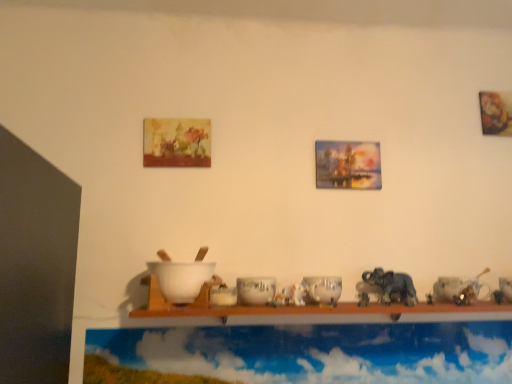
Question: From a real-world perspective, does white glossy bowl at center, which is the 2th tableware in left-to-right order, stand above cloudy sky at upper center?

Choices:
 (A) no
 (B) yes

Answer: (B)

Question: From the image's perspective, does white glossy bowl at center, arranged as the third tableware when viewed from the right, appear lower than cloudy sky at upper center?

Choices:
 (A) yes
 (B) no

Answer: (B)

Question: Is white glossy bowl at center, arranged as the third tableware when viewed from the right, at the left side of cloudy sky at upper center?

Choices:
 (A) no
 (B) yes

Answer: (B)

Question: From the image's perspective, is white glossy bowl at center, arranged as the third tableware when viewed from the right, over cloudy sky at upper center?

Choices:
 (A) yes
 (B) no

Answer: (A)

Question: Considering the relative sizes of white glossy bowl at center, arranged as the third tableware when viewed from the right, and cloudy sky at upper center in the image provided, is white glossy bowl at center, arranged as the third tableware when viewed from the right, wider than cloudy sky at upper center?

Choices:
 (A) no
 (B) yes

Answer: (B)

Question: Does point (144, 132) appear closer or farther from the camera than point (501, 279)?

Choices:
 (A) closer
 (B) farther

Answer: (B)

Question: Is matte wooden picture frame at upper center, the first picture frame positioned from the left, wider or thinner than white glossy bowl at center, which appears as the first tableware when viewed from the right?

Choices:
 (A) thin
 (B) wide

Answer: (A)

Question: From their relative heights in the image, would you say matte wooden picture frame at upper center, the first picture frame positioned from the left, is taller or shorter than white glossy bowl at center, which appears as the first tableware when viewed from the right?

Choices:
 (A) short
 (B) tall

Answer: (B)

Question: In the image, is matte wooden picture frame at upper center, marked as the 2th picture frame in a right-to-left arrangement, positioned in front of or behind white glossy bowl at center, which appears as the first tableware when viewed from the right?

Choices:
 (A) front
 (B) behind

Answer: (B)

Question: Relative to oil painting ship at center, positioned as the second picture frame in left-to-right order, is white matte mixing bowl at center in front or behind?

Choices:
 (A) behind
 (B) front

Answer: (B)

Question: From a real-world perspective, is white matte mixing bowl at center above or below oil painting ship at center, positioned as the second picture frame in left-to-right order?

Choices:
 (A) below
 (B) above

Answer: (A)

Question: From their relative heights in the image, would you say white matte mixing bowl at center is taller or shorter than oil painting ship at center, positioned as the second picture frame in left-to-right order?

Choices:
 (A) tall
 (B) short

Answer: (B)

Question: Does point (199, 264) appear closer or farther from the camera than point (359, 183)?

Choices:
 (A) farther
 (B) closer

Answer: (B)

Question: In terms of size, does white glossy bowl at center, which ranks as the 1th tableware in left-to-right order, appear bigger or smaller than oil painting ship at center, which is the first picture frame from right to left?

Choices:
 (A) big
 (B) small

Answer: (B)

Question: Considering their positions, is white glossy bowl at center, the fourth tableware positioned from the right, located in front of or behind oil painting ship at center, positioned as the second picture frame in left-to-right order?

Choices:
 (A) front
 (B) behind

Answer: (A)